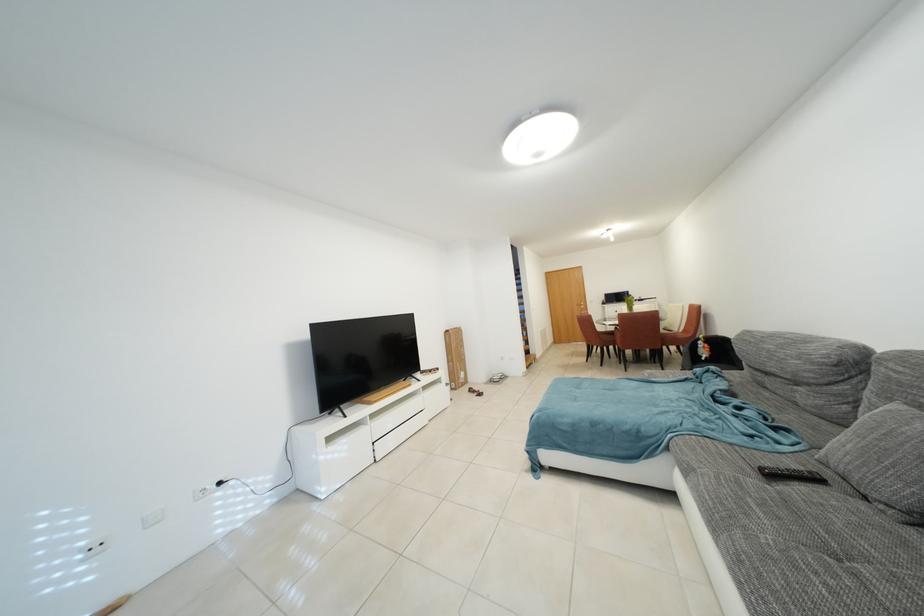
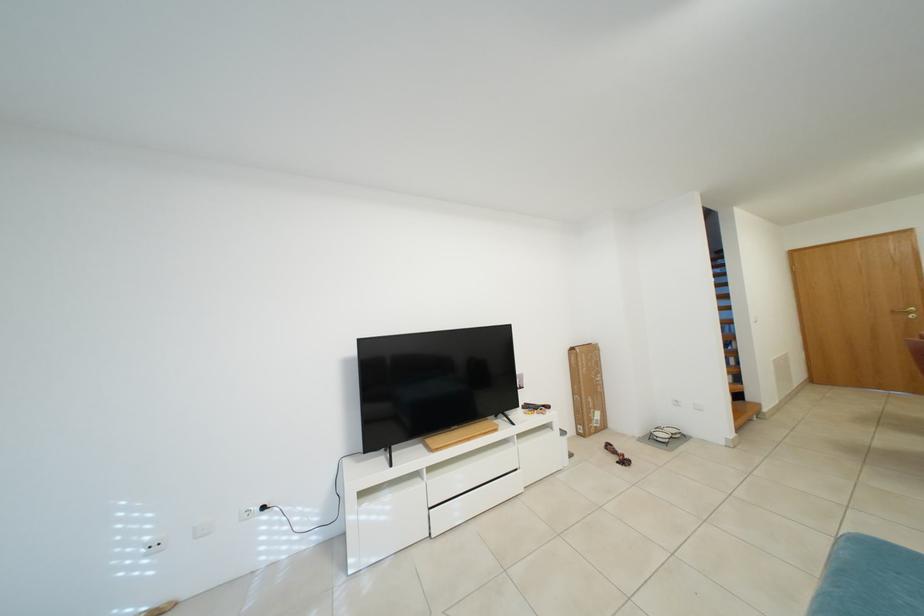
Find the pixel in the second image that matches pixel 479 394 in the first image.

(617, 451)